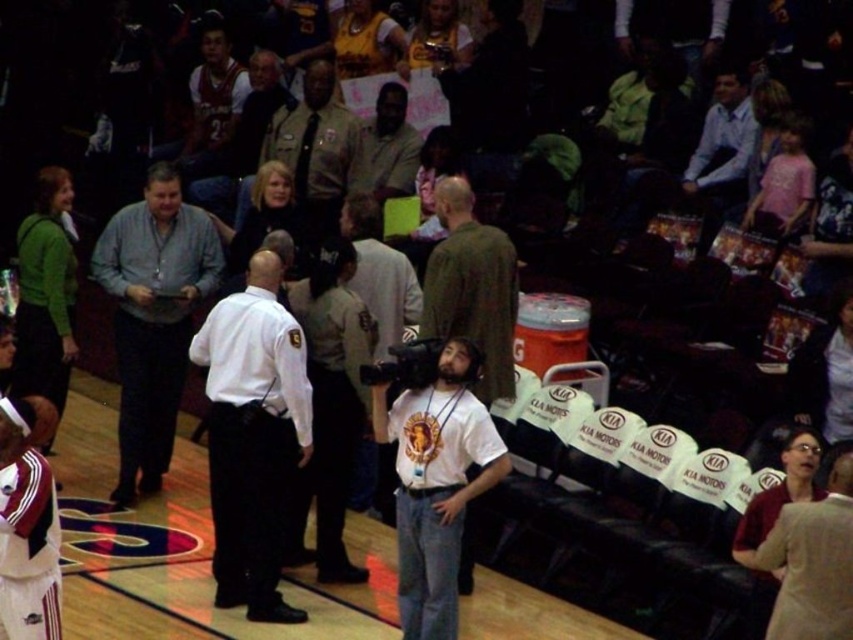
Question: Which of the following is the closest to the observer?

Choices:
 (A) (430, 634)
 (B) (321, 164)

Answer: (A)

Question: Which point is farther to the camera?

Choices:
 (A) beige fabric dress at lower right
 (B) gray shirt at center
 (C) white uniform at center

Answer: (B)

Question: Is white matte t-shirt at center to the left of green fleece jacket at left from the viewer's perspective?

Choices:
 (A) no
 (B) yes

Answer: (A)

Question: Does green matte shirt at center have a lesser width compared to brown leather jacket at center?

Choices:
 (A) yes
 (B) no

Answer: (A)

Question: Among these objects, which one is farthest from the camera?

Choices:
 (A) green matte shirt at center
 (B) dark blue shirt at center
 (C) brown leather jacket at center
 (D) khaki uniform at center

Answer: (C)

Question: Is green fleece jacket at left smaller than brown uniformed officer at center?

Choices:
 (A) no
 (B) yes

Answer: (B)